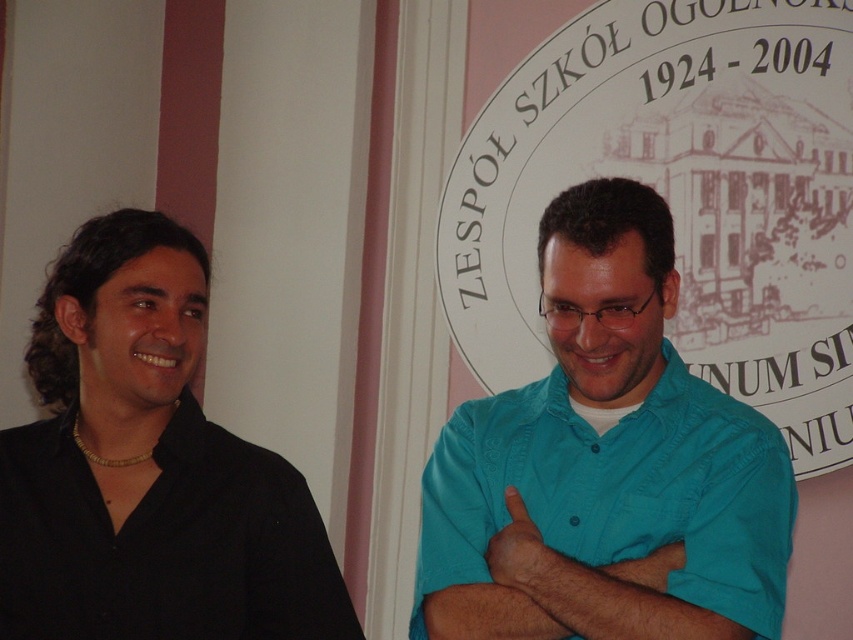
You are standing in the school hallway and see two points marked on the floor. The first point is at coordinate point (525, 504) and the second is at point (57, 362). If you walk towards the wall with the emblem, which point will you step on first?

Point (525, 504) is in front of point (57, 362), so you will step on point (525, 504) first as you walk towards the wall with the emblem.